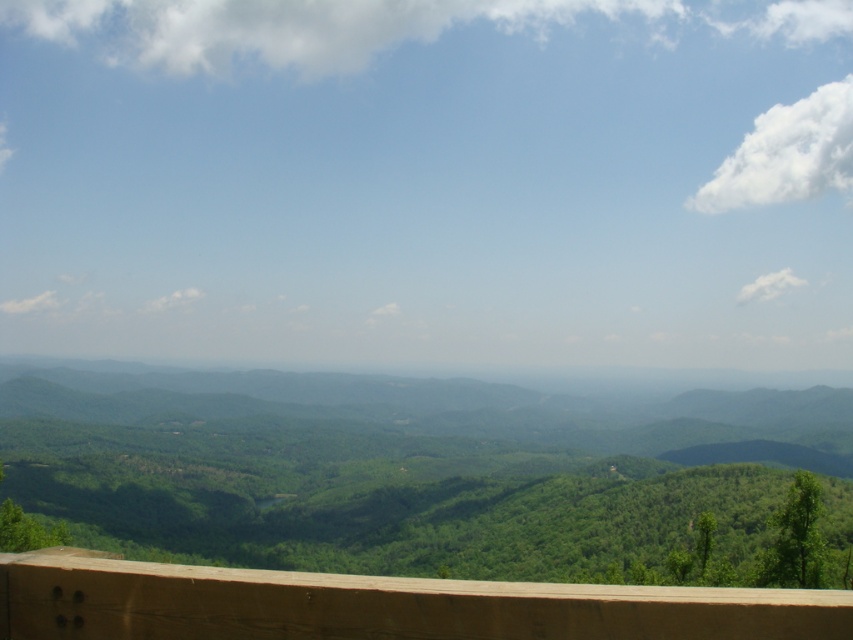
You are a hiker standing at the scenic overlook. You notice the green matte forest at center and the brown wooden ledge at lower center. Which object occupies more horizontal space in the image?

The green matte forest at center is wider than the brown wooden ledge at lower center, so it occupies more horizontal space.

You are standing at the wooden railing in the foreground of the mountain view. There is a point marked at coordinates (428, 476). What does this point represent in the scene?

The point at coordinates (428, 476) corresponds to the green matte forest at center.